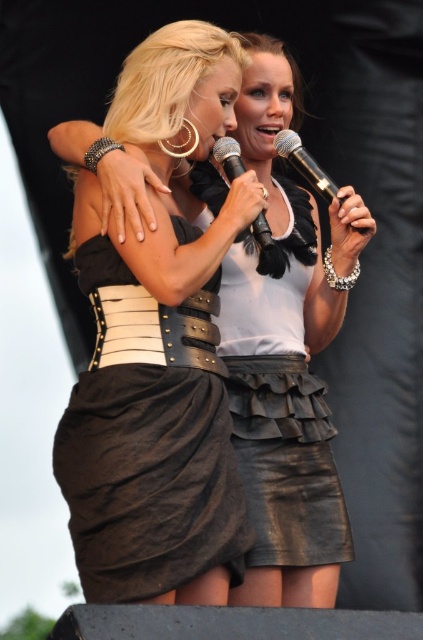
Is point (308, 444) farther from viewer compared to point (269, 449)?

Yes, it is.

Does point (255, 468) come closer to viewer compared to point (280, 509)?

No, (255, 468) is further to viewer.

Who is more distant from viewer, (x=324, y=468) or (x=258, y=451)?

Point (x=324, y=468)

This screenshot has width=423, height=640. What are the coordinates of `black leather skirt at center` in the screenshot? It's located at pyautogui.click(x=285, y=353).

Does leather skirt at center have a lesser width compared to metallic silver microphone at center?

Yes.

Is leather skirt at center positioned before metallic silver microphone at center?

No, leather skirt at center is further to the viewer.

Does point (274, 324) lie behind point (228, 173)?

Yes, it is.

The image size is (423, 640). Identify the location of leather skirt at center. (280, 400).

Does leather skirt at center have a greater width compared to black matte microphone at center?

In fact, leather skirt at center might be narrower than black matte microphone at center.

Does leather skirt at center appear on the right side of black matte microphone at center?

No, leather skirt at center is not to the right of black matte microphone at center.

Is point (269, 323) positioned behind point (323, 172)?

Yes, point (269, 323) is behind point (323, 172).

The height and width of the screenshot is (640, 423). What are the coordinates of `leather skirt at center` in the screenshot? It's located at (280, 400).